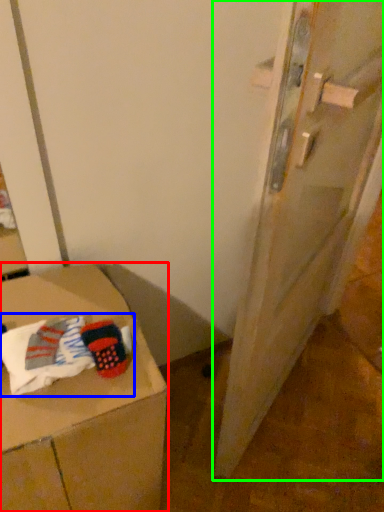
Question: Which object is the closest to the furniture (highlighted by a red box)? Choose among these: laundry (highlighted by a blue box) or door (highlighted by a green box).

Choices:
 (A) laundry
 (B) door

Answer: (A)